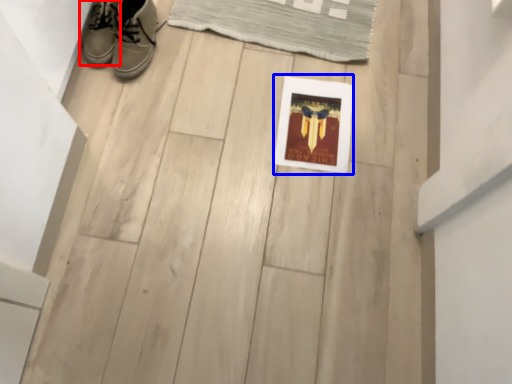
Question: Which point is further to the camera, footwear (highlighted by a red box) or picture frame (highlighted by a blue box)?

Choices:
 (A) footwear
 (B) picture frame

Answer: (B)